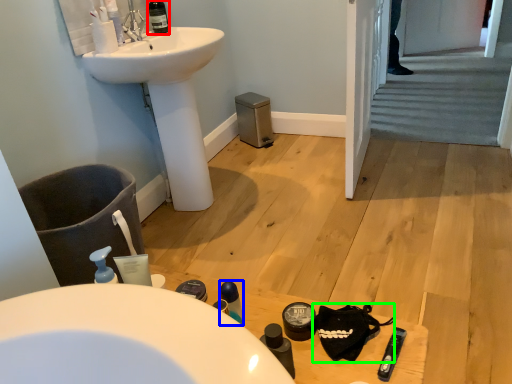
Question: Considering the real-world distances, which object is closest to wine bottle (highlighted by a red box)? mouthwash (highlighted by a blue box) or accessory (highlighted by a green box).

Choices:
 (A) mouthwash
 (B) accessory

Answer: (A)